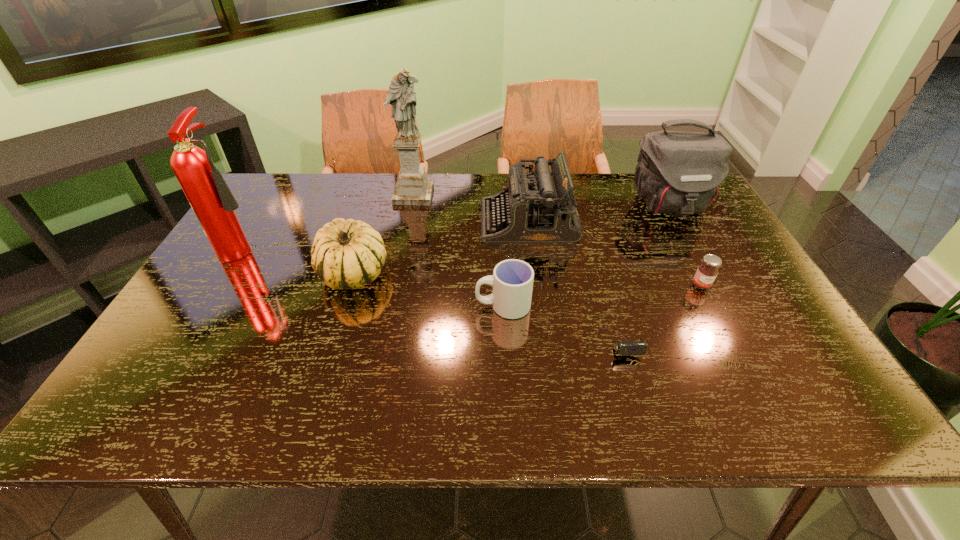
Select which object appears as the closest to the gourd. Please provide its 2D coordinates. Your answer should be formatted as a tuple, i.e. [(x, y)], where the tuple contains the x and y coordinates of a point satisfying the conditions above.

[(213, 203)]

Identify the location of vacant position in the image that satisfies the following two spatial constraints: 1. on the front-facing side of the sculpture; 2. at the nozzle of the fire extinguisher. Image resolution: width=960 pixels, height=540 pixels. (403, 246).